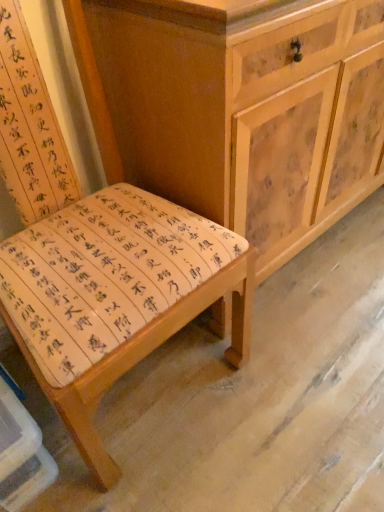
What are the coordinates of `free area in between wooden bench at center and wooden cabinet at center` in the screenshot? It's located at (305, 308).